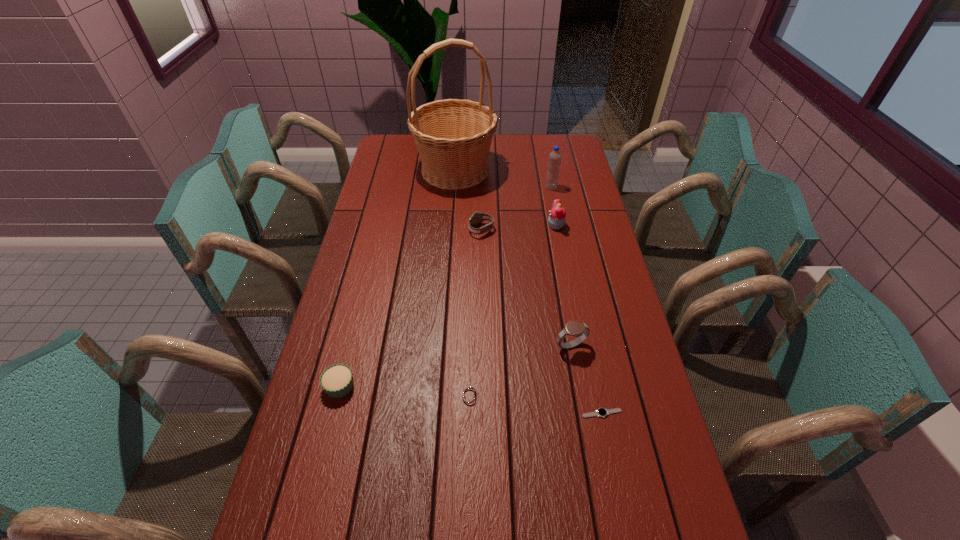
You are a GUI agent. You are given a task and a screenshot of the screen. Output one action in this format:
    pyautogui.click(x=<x>, y=<y>)
    Task: Click on the vacant area that lies between the second shortest watch and the tallest watch
    This screenshot has height=540, width=960.
    Given the screenshot: What is the action you would take?
    pyautogui.click(x=520, y=371)

Identify the location of free space that is in between the tallest object and the sixth tallest object. (397, 278).

You are a GUI agent. You are given a task and a screenshot of the screen. Output one action in this format:
    pyautogui.click(x=<x>, y=<y>)
    Task: Click on the vacant area that lies between the right cupcake and the second farthest watch
    
    Given the screenshot: What is the action you would take?
    pyautogui.click(x=564, y=286)

Where is `vacant area between the third shortest object and the farther cupcake`? The width and height of the screenshot is (960, 540). vacant area between the third shortest object and the farther cupcake is located at coordinates (447, 306).

This screenshot has width=960, height=540. I want to click on free space between the third shortest watch and the seventh tallest object, so click(x=475, y=313).

Point out which object is positioned as the fifth nearest to the fifth shortest object. Please provide its 2D coordinates. Your answer should be formatted as a tuple, i.e. [(x, y)], where the tuple contains the x and y coordinates of a point satisfying the conditions above.

[(337, 380)]

Identify which object is the fourth closest to the second shortest object. Please provide its 2D coordinates. Your answer should be formatted as a tuple, i.e. [(x, y)], where the tuple contains the x and y coordinates of a point satisfying the conditions above.

[(476, 218)]

Identify which watch is located as the third nearest to the third tallest watch. Please provide its 2D coordinates. Your answer should be formatted as a tuple, i.e. [(x, y)], where the tuple contains the x and y coordinates of a point satisfying the conditions above.

[(476, 218)]

Image resolution: width=960 pixels, height=540 pixels. I want to click on watch that is the second closest to the tallest watch, so click(469, 395).

You are a GUI agent. You are given a task and a screenshot of the screen. Output one action in this format:
    pyautogui.click(x=<x>, y=<y>)
    Task: Click on the blank space that satisfies the following two spatial constraints: 1. on the face of the shortest object; 2. on the left side of the second shortest object
    This screenshot has height=540, width=960.
    Given the screenshot: What is the action you would take?
    tap(469, 413)